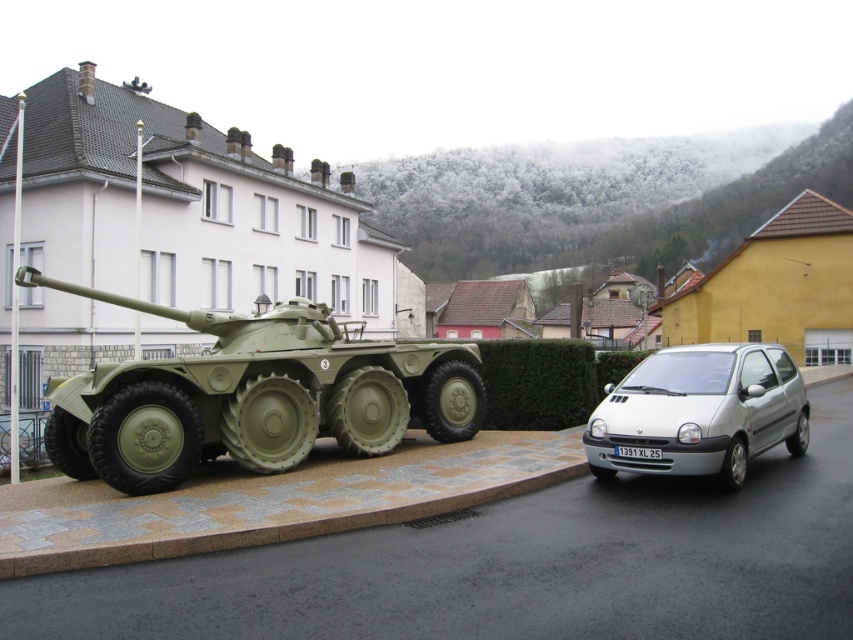
Consider the image. You are a delivery driver who needs to back up your silver metallic hatchback at right into a parking spot behind the matte green tank at center. Considering the space between them, can you safely maneuver your car without hitting the tank?

The distance between the matte green tank at center and the silver metallic hatchback at right is 22.27 feet, which is sufficient space for backing up safely without hitting the tank.

You are a delivery person who needs to park your delivery van between the silver metallic hatchback at right and the white plastic license plate at center. The van is 2.5 meters long. Can you fit it there?

The distance between the silver metallic hatchback at right and the white plastic license plate at center is 1.27 meters, which is shorter than the van length of 2.5 meters. Therefore, the van cannot fit in that space.

You are a photographer trying to capture both the matte green tank at center and the white plastic license plate at center in a single frame. Which object should you focus on first to ensure both are in focus, considering their sizes and positions?

The matte green tank at center is taller than the white plastic license plate at center, so you should focus on the matte green tank at center first to ensure both are in focus.